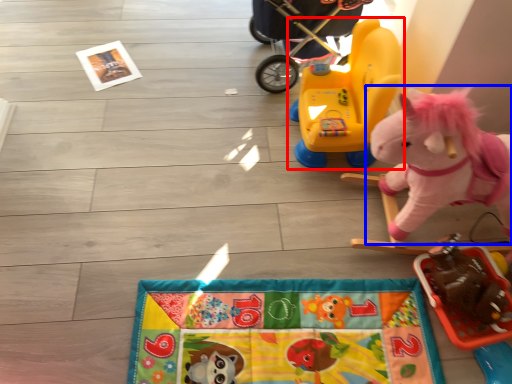
Question: Which object is closer to the camera taking this photo, toy (highlighted by a red box) or toy (highlighted by a blue box)?

Choices:
 (A) toy
 (B) toy

Answer: (B)